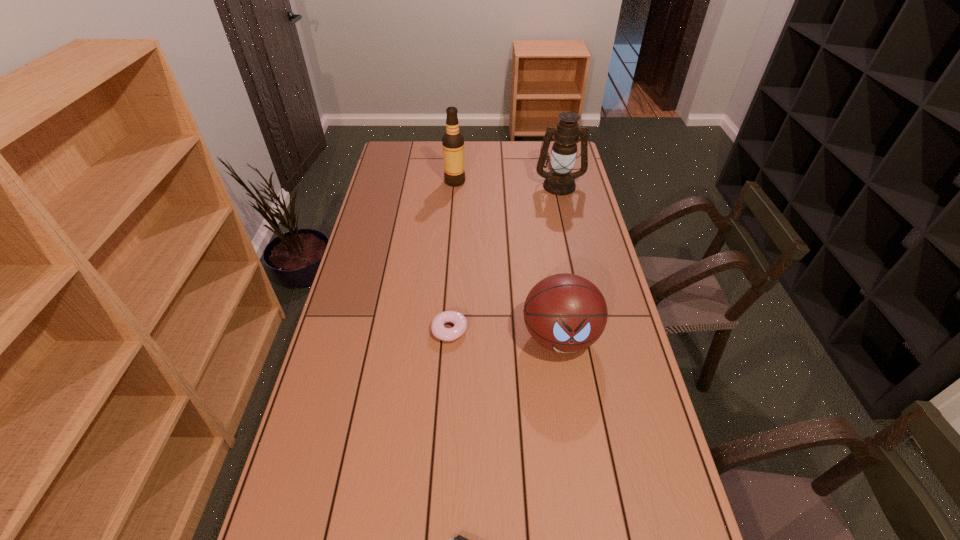
At what (x,y) coordinates should I click in order to perform the action: click on vacant region at the far edge of the desktop. Please return your answer as a coordinate pair (x, y). Looking at the image, I should click on (487, 164).

Locate an element on the screen. The width and height of the screenshot is (960, 540). vacant space at the left edge is located at coordinates (370, 206).

In the image, there is a desktop. At what (x,y) coordinates should I click in order to perform the action: click on vacant space at the right edge. Please return your answer as a coordinate pair (x, y). The width and height of the screenshot is (960, 540). Looking at the image, I should click on (574, 245).

You are a GUI agent. You are given a task and a screenshot of the screen. Output one action in this format:
    pyautogui.click(x=<x>, y=<y>)
    Task: Click on the free space at the far left corner
    This screenshot has width=960, height=540.
    Given the screenshot: What is the action you would take?
    pyautogui.click(x=392, y=158)

Where is `vacant point located between the basketball and the doughnut`? The image size is (960, 540). vacant point located between the basketball and the doughnut is located at coordinates (505, 334).

Find the location of a particular element. empty space that is in between the oil lamp and the third tallest object is located at coordinates (560, 261).

The image size is (960, 540). I want to click on vacant space that is in between the basketball and the alcohol, so click(x=508, y=259).

Locate an element on the screen. Image resolution: width=960 pixels, height=540 pixels. vacant area that lies between the basketball and the alcohol is located at coordinates (508, 259).

I want to click on free space that is in between the alcohol and the doughnut, so 452,256.

This screenshot has height=540, width=960. I want to click on vacant space that is in between the alcohol and the basketball, so click(x=508, y=259).